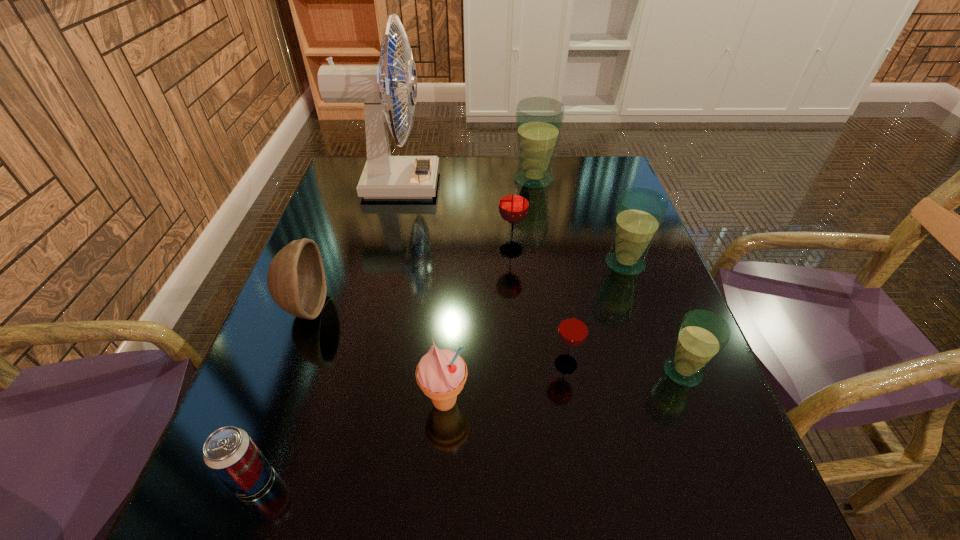
Where is `object present at the near left corner`? The height and width of the screenshot is (540, 960). object present at the near left corner is located at coordinates (229, 452).

The height and width of the screenshot is (540, 960). In the image, there is a desktop. Find the location of `vacant area at the far edge`. vacant area at the far edge is located at coordinates (500, 157).

At what (x,y) coordinates should I click in order to perform the action: click on vacant space at the near edge of the desktop. Please return your answer as a coordinate pair (x, y). The image size is (960, 540). Looking at the image, I should click on (418, 501).

At what (x,y) coordinates should I click in order to perform the action: click on vacant space at the left edge. Please return your answer as a coordinate pair (x, y). This screenshot has height=540, width=960. Looking at the image, I should click on (363, 273).

The width and height of the screenshot is (960, 540). I want to click on vacant space at the right edge of the desktop, so click(589, 201).

The image size is (960, 540). I want to click on vacant space at the far left corner of the desktop, so click(356, 192).

Find the location of `vacant point at the far right corner`. vacant point at the far right corner is located at coordinates (590, 172).

You are a GUI agent. You are given a task and a screenshot of the screen. Output one action in this format:
    pyautogui.click(x=<x>, y=<y>)
    Task: Click on the unoccupied position between the nearest object and the smaller red glass
    The width and height of the screenshot is (960, 540).
    Given the screenshot: What is the action you would take?
    pyautogui.click(x=409, y=422)

Where is `vacant area that lies between the fan and the fifth nearest object`? The image size is (960, 540). vacant area that lies between the fan and the fifth nearest object is located at coordinates (349, 246).

This screenshot has width=960, height=540. I want to click on vacant point located between the smaller red glass and the left red glass, so click(x=539, y=307).